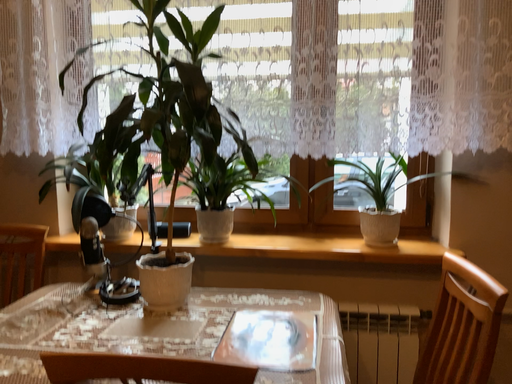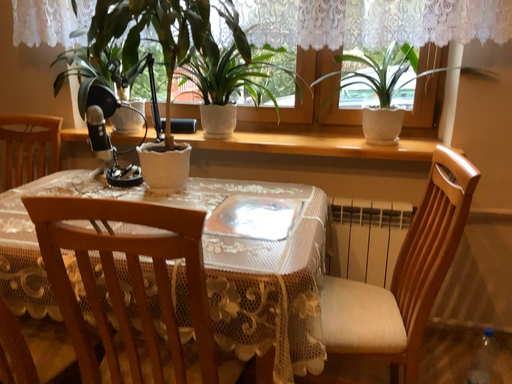
Question: Which way did the camera rotate in the video?

Choices:
 (A) rotated downward
 (B) rotated upward

Answer: (A)